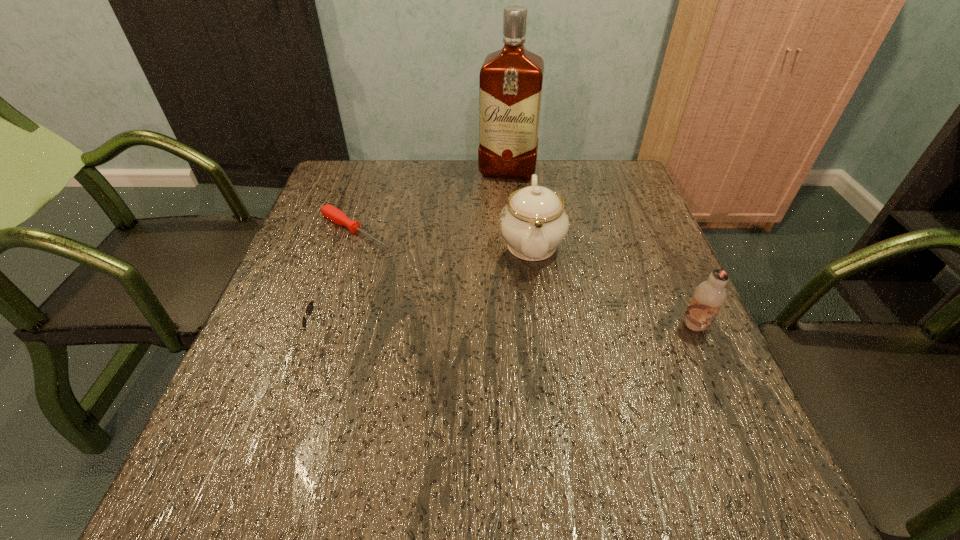
At what (x,y) coordinates should I click in order to perform the action: click on vacant area situated 0.290m at the spout of the chinaware. Please return your answer as a coordinate pair (x, y). Looking at the image, I should click on (540, 390).

Where is `vacant region located 0.370m at the tip of the screwdriver`? vacant region located 0.370m at the tip of the screwdriver is located at coordinates (502, 316).

The width and height of the screenshot is (960, 540). I want to click on vacant region located at the tip of the screwdriver, so click(x=466, y=294).

Locate an element on the screen. The image size is (960, 540). free point located at the tip of the screwdriver is located at coordinates (399, 254).

Find the location of a particular element. The width and height of the screenshot is (960, 540). vacant space located on the front label of the liquor is located at coordinates (499, 207).

You are a GUI agent. You are given a task and a screenshot of the screen. Output one action in this format:
    pyautogui.click(x=<x>, y=<y>)
    Task: Click on the vacant space located on the front label of the liquor
    
    Given the screenshot: What is the action you would take?
    pyautogui.click(x=486, y=274)

Image resolution: width=960 pixels, height=540 pixels. I want to click on free space located 0.120m on the front label of the liquor, so click(x=499, y=207).

Locate an element on the screen. The image size is (960, 540). object that is at the far edge is located at coordinates (511, 79).

Locate an element on the screen. Image resolution: width=960 pixels, height=540 pixels. sunglasses that is at the left edge is located at coordinates tap(309, 308).

The height and width of the screenshot is (540, 960). What are the coordinates of `screwdriver that is at the left edge` in the screenshot? It's located at (335, 215).